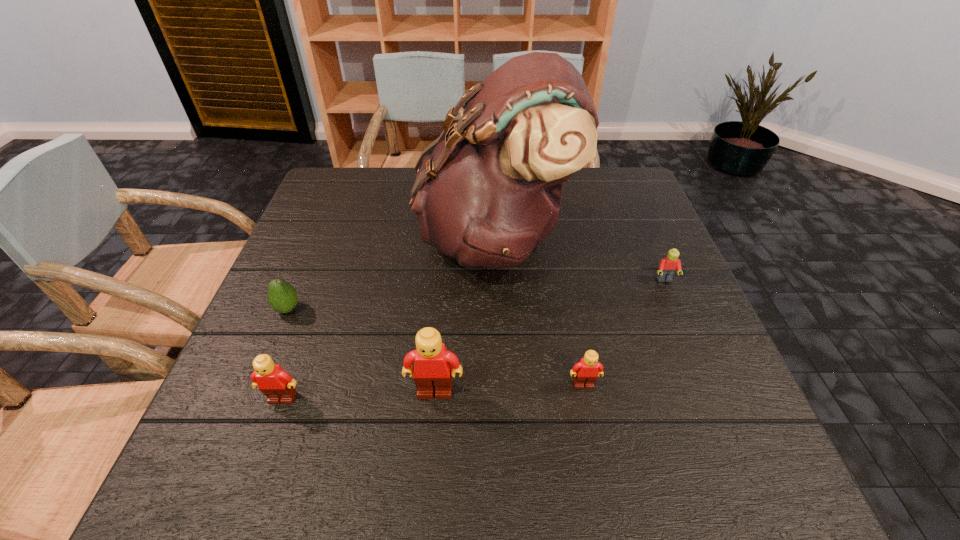
Locate an element on the screen. Image resolution: width=960 pixels, height=540 pixels. free space for a new Lego on the right is located at coordinates (729, 378).